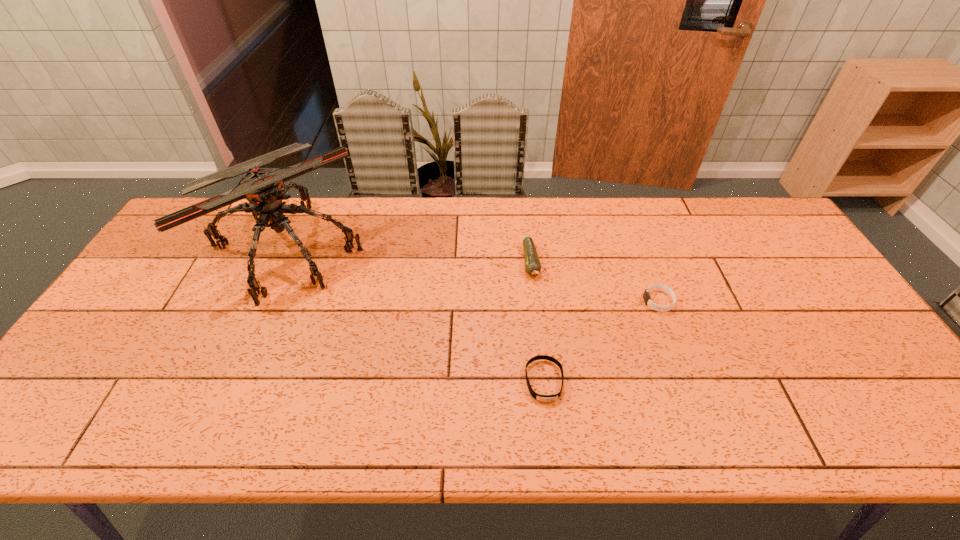
Find the location of `free space between the shortest object and the third shortest object`. free space between the shortest object and the third shortest object is located at coordinates (538, 321).

Identify the location of vacant point located between the farther wristband and the drone. (472, 274).

The width and height of the screenshot is (960, 540). I want to click on free spot between the second tallest object and the rightmost object, so click(595, 281).

Where is `free spot between the zucchini and the leftmost object`? Image resolution: width=960 pixels, height=540 pixels. free spot between the zucchini and the leftmost object is located at coordinates (409, 255).

Find the location of a particular element. vacant area that lies between the rightmost object and the zucchini is located at coordinates (595, 281).

Locate an element on the screen. The width and height of the screenshot is (960, 540). free space between the third shortest object and the right wristband is located at coordinates point(595,281).

The image size is (960, 540). In order to click on empty location between the farther wristband and the left wristband in this screenshot , I will do `click(602, 341)`.

The height and width of the screenshot is (540, 960). What are the coordinates of `free spot between the drone and the farther wristband` in the screenshot? It's located at (472, 274).

Image resolution: width=960 pixels, height=540 pixels. Find the location of `free space between the third shortest object and the drone`. free space between the third shortest object and the drone is located at coordinates (409, 255).

You are a GUI agent. You are given a task and a screenshot of the screen. Output one action in this format:
    pyautogui.click(x=<x>, y=<y>)
    Task: Click on the empty space that is in between the second tallest object and the nearest object
    The image size is (960, 540).
    Given the screenshot: What is the action you would take?
    pyautogui.click(x=538, y=321)